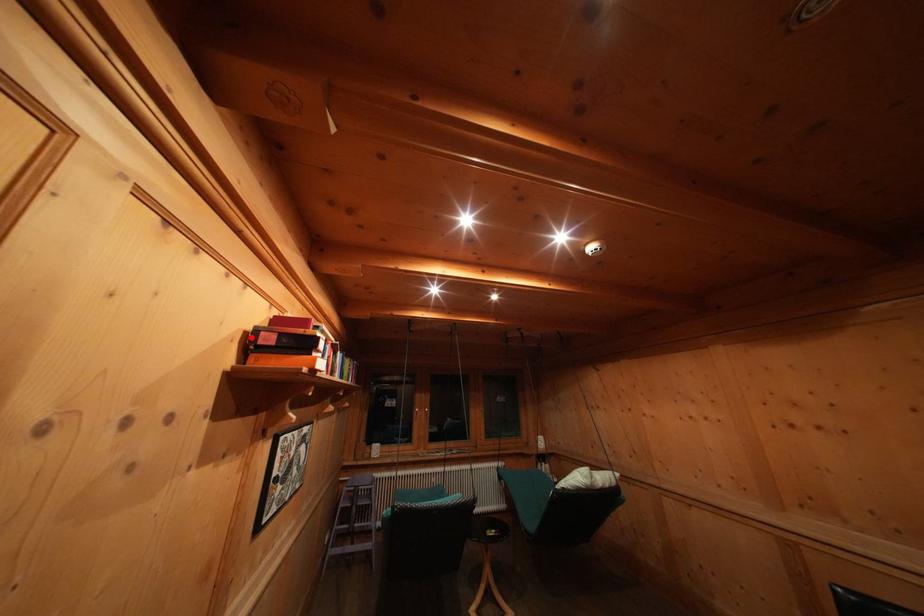
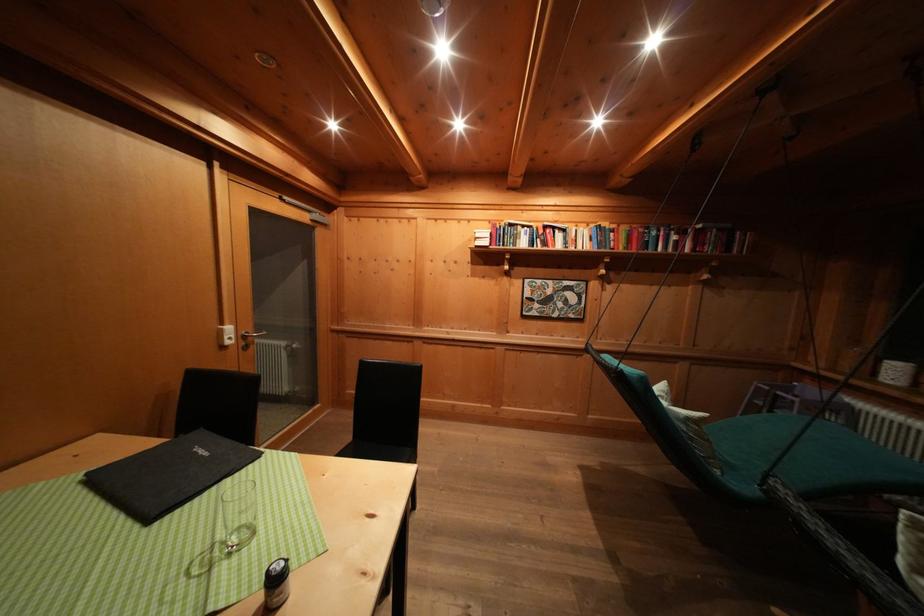
Question: I am providing you with two images of the same scene from different viewpoints. A red point is marked on the first image. At the location where the point appears in image 1, is it still visible in image 2?

Choices:
 (A) Yes
 (B) No

Answer: (B)